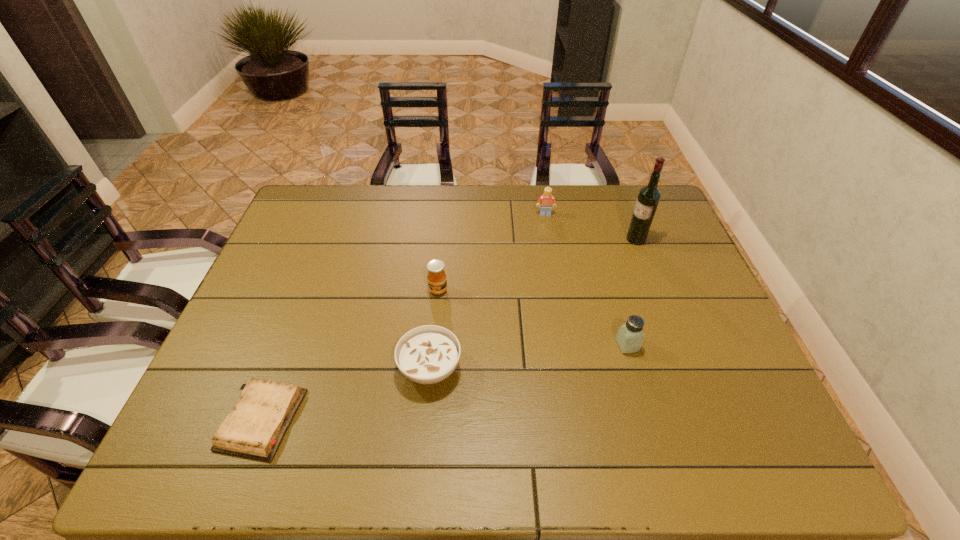
Where is `object present at the right edge`? This screenshot has height=540, width=960. object present at the right edge is located at coordinates (649, 196).

Locate an element on the screen. The image size is (960, 540). object present at the near left corner is located at coordinates (254, 429).

Locate an element on the screen. vacant space at the far edge of the desktop is located at coordinates (598, 226).

Where is `vacant point at the near edge`? vacant point at the near edge is located at coordinates [542, 447].

This screenshot has height=540, width=960. I want to click on vacant space at the left edge of the desktop, so click(300, 234).

Locate an element on the screen. The image size is (960, 540). vacant space at the far left corner is located at coordinates (x=304, y=192).

At what (x,y) coordinates should I click in order to perform the action: click on free spot between the shortest object and the second object from right to left. Please return your answer as a coordinate pair (x, y). The height and width of the screenshot is (540, 960). Looking at the image, I should click on (444, 382).

Image resolution: width=960 pixels, height=540 pixels. Identify the location of free space between the third farthest object and the farthest object. (492, 252).

Locate an element on the screen. This screenshot has width=960, height=540. vacant area between the saltshaker and the second shortest object is located at coordinates (529, 357).

Find the location of a particular element. Image resolution: width=960 pixels, height=540 pixels. free area in between the tallest object and the second object from right to left is located at coordinates (632, 292).